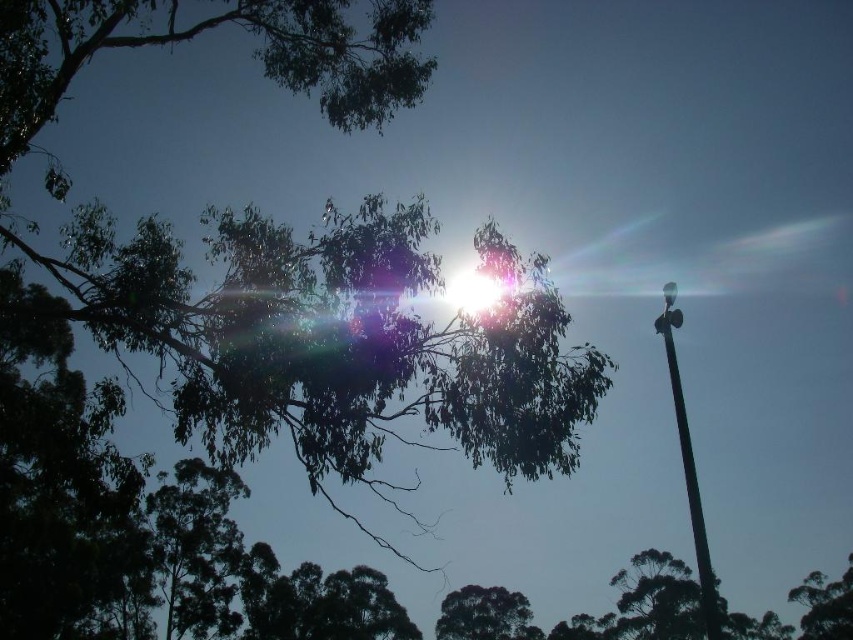
Question: Which of the following is the farthest from the observer?

Choices:
 (A) dark green leafy tree at upper left
 (B) green leafy tree at upper center
 (C) metallic pole at right

Answer: (B)

Question: Is dark green leafy tree at upper left above dark green leafy tree at lower center?

Choices:
 (A) no
 (B) yes

Answer: (B)

Question: Is metallic pole at right to the left of green leafy tree at upper center from the viewer's perspective?

Choices:
 (A) no
 (B) yes

Answer: (B)

Question: Estimate the real-world distances between objects in this image. Which object is farther from the dark green leafy tree at lower center?

Choices:
 (A) dark green leafy tree at upper left
 (B) metallic pole at right

Answer: (A)

Question: Which is farther from the metallic pole at right?

Choices:
 (A) green leafy tree at upper center
 (B) dark green leafy tree at lower center

Answer: (A)

Question: Can you confirm if dark green leafy tree at upper left is positioned to the left of metallic pole at right?

Choices:
 (A) no
 (B) yes

Answer: (B)